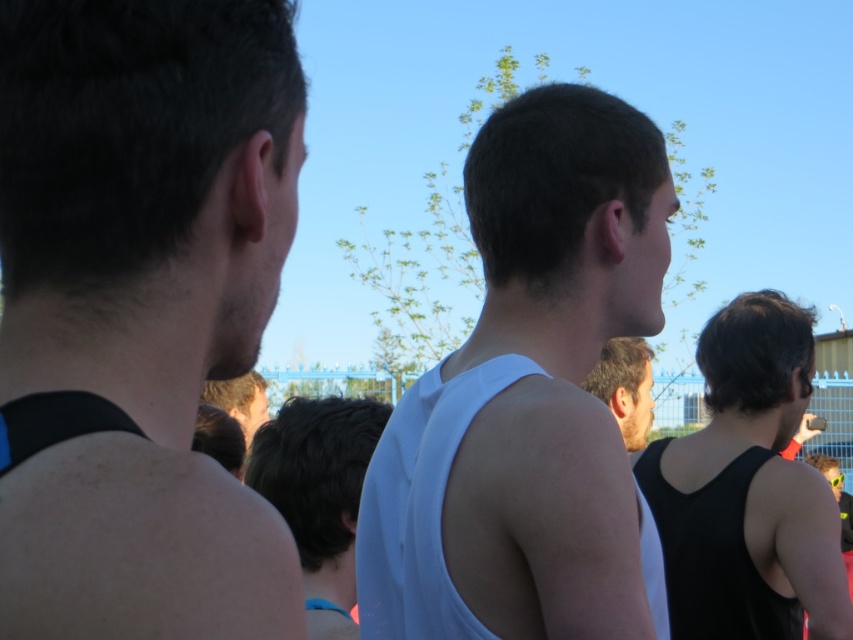
Question: Where is white matte tank top at center located in relation to matte black tank top at center in the image?

Choices:
 (A) left
 (B) right

Answer: (B)

Question: Which point appears farthest from the camera in this image?

Choices:
 (A) (299, 134)
 (B) (227, 408)
 (C) (708, 611)

Answer: (B)

Question: Can you confirm if black matte tank top at left is smaller than black matte tank top at right?

Choices:
 (A) yes
 (B) no

Answer: (A)

Question: Where is white matte tank top at center located in relation to dark brown hair at center in the image?

Choices:
 (A) below
 (B) above

Answer: (B)

Question: Among these objects, which one is farthest from the camera?

Choices:
 (A) dark brown hair at center
 (B) matte black tank top at center

Answer: (B)

Question: Which object appears farthest from the camera in this image?

Choices:
 (A) black matte tank top at left
 (B) white matte tank top at center

Answer: (B)